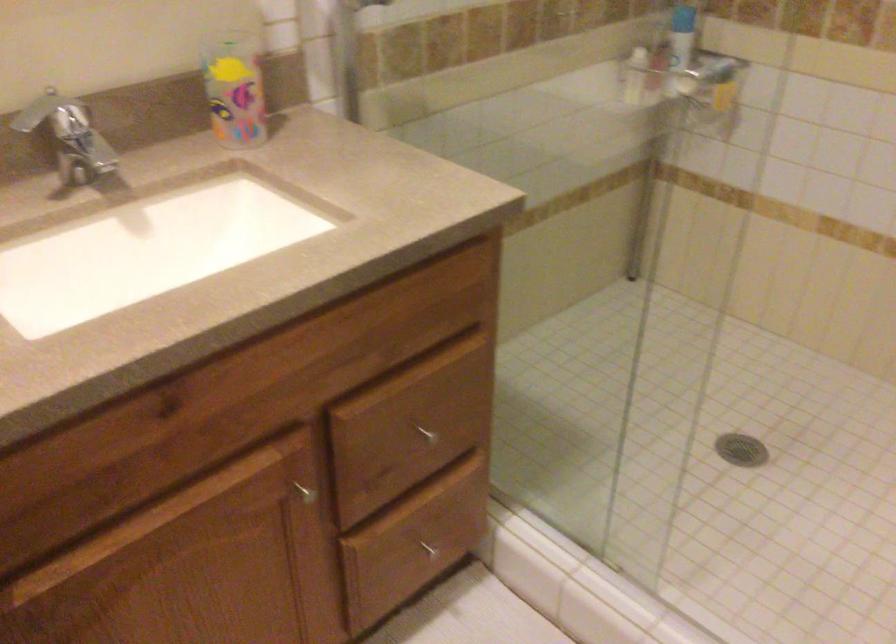
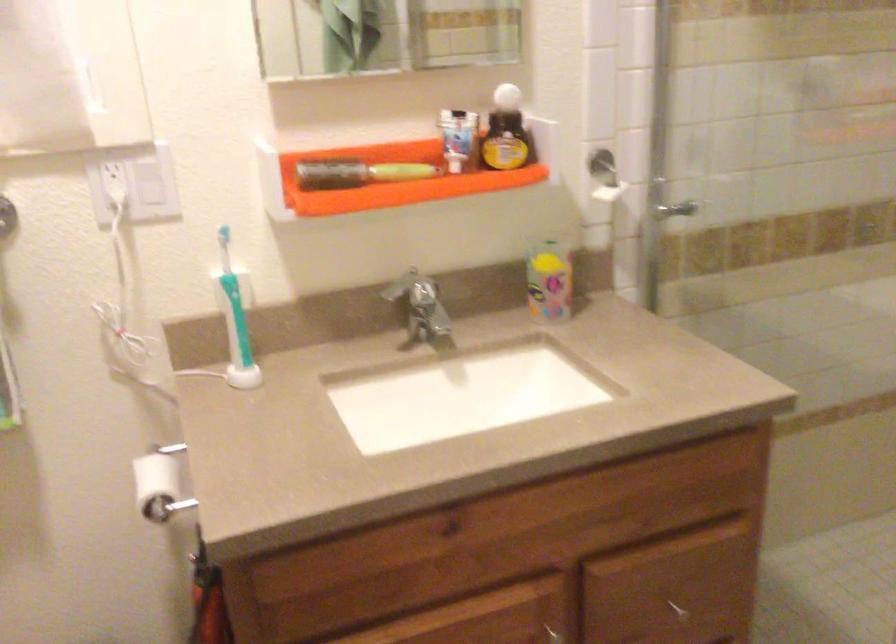
Locate, in the second image, the point that corresponds to (311,498) in the first image.

(555, 635)